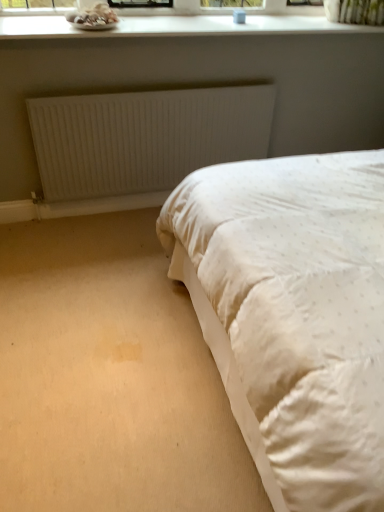
Question: In the image, is white matte radiator at upper center on the left side or the right side of white smooth window sill at upper center?

Choices:
 (A) right
 (B) left

Answer: (B)

Question: From a real-world perspective, relative to white smooth window sill at upper center, is white matte radiator at upper center vertically above or below?

Choices:
 (A) above
 (B) below

Answer: (B)

Question: Is point (167, 139) positioned closer to the camera than point (233, 29)?

Choices:
 (A) closer
 (B) farther

Answer: (B)

Question: Is white smooth window sill at upper center taller or shorter than white matte radiator at upper center?

Choices:
 (A) short
 (B) tall

Answer: (A)

Question: Based on their positions, is white smooth window sill at upper center located to the left or right of white matte radiator at upper center?

Choices:
 (A) left
 (B) right

Answer: (B)

Question: Is white smooth window sill at upper center wider or thinner than white matte radiator at upper center?

Choices:
 (A) thin
 (B) wide

Answer: (B)

Question: From a real-world perspective, is white smooth window sill at upper center above or below white matte radiator at upper center?

Choices:
 (A) above
 (B) below

Answer: (A)